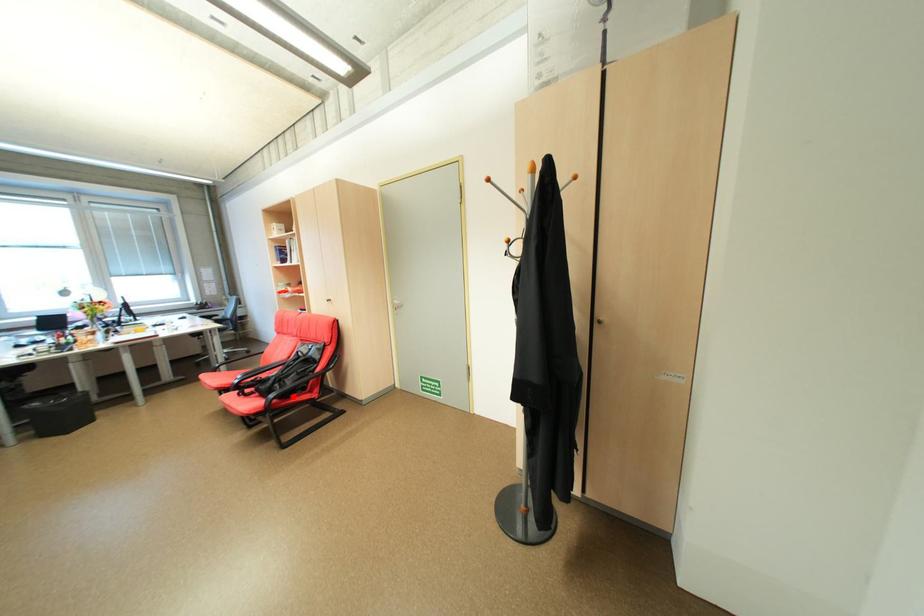
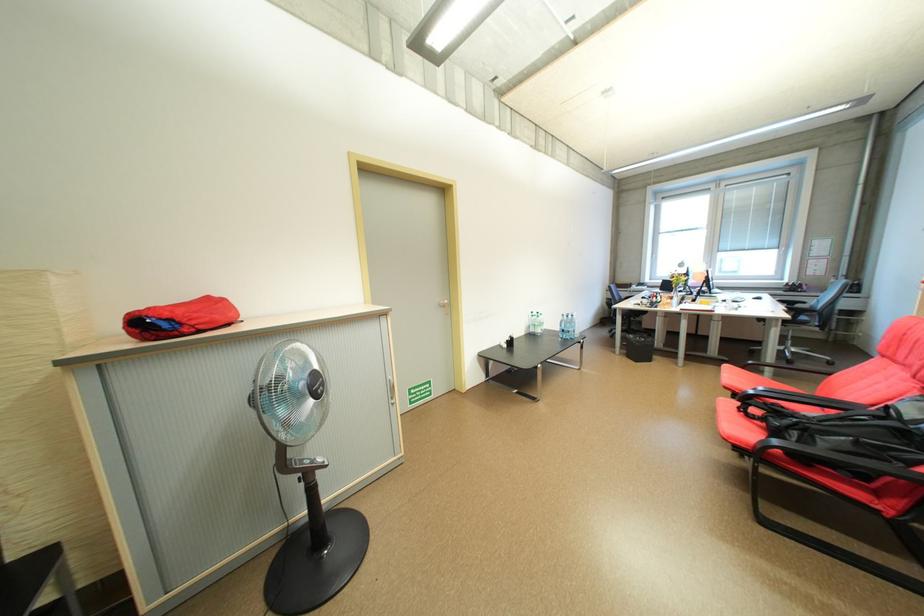
Question: I am providing you with two images of the same scene from different viewpoints. Image1 has a red point marked. In image2, the corresponding 3D location appears at what relative position? Reply with the corresponding letter.

Choices:
 (A) Closer
 (B) Farther

Answer: (B)